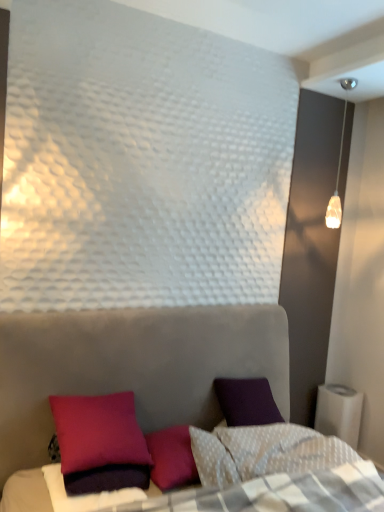
You are a GUI agent. You are given a task and a screenshot of the screen. Output one action in this format:
    pyautogui.click(x=<x>, y=<y>)
    Task: Click on the translucent glass pendant light at upper right
    The width and height of the screenshot is (384, 512).
    Given the screenshot: What is the action you would take?
    pyautogui.click(x=336, y=190)

From the picture: Is velvet purple pillow at lower left directly adjacent to purple matte pillow at lower left?

There is a gap between velvet purple pillow at lower left and purple matte pillow at lower left.

Considering the positions of objects velvet purple pillow at lower left and purple matte pillow at lower left in the image provided, who is more to the right, velvet purple pillow at lower left or purple matte pillow at lower left?

From the viewer's perspective, velvet purple pillow at lower left appears more on the right side.

This screenshot has height=512, width=384. I want to click on sheet in front of the velvet purple pillow at lower left, so click(x=85, y=495).

In the image, is velvet purple pillow at lower left positioned in front of or behind purple matte pillow at lower left?

velvet purple pillow at lower left is positioned farther from the viewer than purple matte pillow at lower left.

From a real-world perspective, between purple matte pillow at lower left and translucent glass pendant light at upper right, who is vertically lower?

purple matte pillow at lower left, from a real-world perspective.

Relative to translucent glass pendant light at upper right, is purple matte pillow at lower left in front or behind?

Visually, purple matte pillow at lower left is located in front of translucent glass pendant light at upper right.

Between purple matte pillow at lower left and translucent glass pendant light at upper right, which one has smaller size?

purple matte pillow at lower left.

Is purple matte pillow at lower left spatially inside translucent glass pendant light at upper right, or outside of it?

purple matte pillow at lower left is not inside translucent glass pendant light at upper right, it's outside.

From the image's perspective, which one is positioned lower, purple matte pillow at lower left or velvet purple pillow at lower left?

purple matte pillow at lower left.

How different are the orientations of purple matte pillow at lower left and velvet purple pillow at lower left in degrees?

There is a 1.27-degree angle between the facing directions of purple matte pillow at lower left and velvet purple pillow at lower left.

Looking at this image, is purple matte pillow at lower left turned away from velvet purple pillow at lower left?

No, purple matte pillow at lower left is not facing the opposite direction of velvet purple pillow at lower left.

Would you say purple matte pillow at lower left is outside velvet purple pillow at lower left?

That's correct, purple matte pillow at lower left is outside of velvet purple pillow at lower left.

From the image's perspective, is translucent glass pendant light at upper right located beneath velvet purple pillow at lower left?

No.

Measure the distance from translucent glass pendant light at upper right to velvet purple pillow at lower left.

translucent glass pendant light at upper right and velvet purple pillow at lower left are 6.41 feet apart from each other.

How different are the orientations of translucent glass pendant light at upper right and velvet purple pillow at lower left in degrees?

The angular difference between translucent glass pendant light at upper right and velvet purple pillow at lower left is 2.29 degrees.

This screenshot has width=384, height=512. I want to click on lamp behind the velvet purple pillow at lower left, so click(336, 190).

Which object is positioned more to the left, velvet purple pillow at lower left or translucent glass pendant light at upper right?

Positioned to the left is velvet purple pillow at lower left.

Considering the relative sizes of velvet purple pillow at lower left and translucent glass pendant light at upper right in the image provided, is velvet purple pillow at lower left smaller than translucent glass pendant light at upper right?

No, velvet purple pillow at lower left is not smaller than translucent glass pendant light at upper right.

Considering their positions, is velvet purple pillow at lower left located in front of or behind translucent glass pendant light at upper right?

Clearly, velvet purple pillow at lower left is in front of translucent glass pendant light at upper right.

Is purple matte pillow at lower left at the back of translucent glass pendant light at upper right?

translucent glass pendant light at upper right does not have its back to purple matte pillow at lower left.

Which of these two, translucent glass pendant light at upper right or purple matte pillow at lower left, is thinner?

With smaller width is translucent glass pendant light at upper right.

Is purple matte pillow at lower left surrounded by translucent glass pendant light at upper right?

No, purple matte pillow at lower left is not a part of translucent glass pendant light at upper right.

In terms of height, does translucent glass pendant light at upper right look taller or shorter compared to purple matte pillow at lower left?

Clearly, translucent glass pendant light at upper right is taller compared to purple matte pillow at lower left.

Where is `sheet below the velvet purple pillow at lower left (from a real-world perspective)`? Image resolution: width=384 pixels, height=512 pixels. sheet below the velvet purple pillow at lower left (from a real-world perspective) is located at coordinates (85, 495).

Where is `lamp above the purple matte pillow at lower left (from the image's perspective)`? This screenshot has height=512, width=384. lamp above the purple matte pillow at lower left (from the image's perspective) is located at coordinates (336, 190).

From the image, which object appears to be farther from translucent glass pendant light at upper right, velvet purple pillow at lower left or purple matte pillow at lower left?

purple matte pillow at lower left.

From the picture: From the image, which object appears to be farther from velvet purple pillow at lower left, translucent glass pendant light at upper right or purple matte pillow at lower left?

Based on the image, translucent glass pendant light at upper right appears to be further to velvet purple pillow at lower left.

Which object lies further to the anchor point velvet purple pillow at lower left, purple matte pillow at lower left or translucent glass pendant light at upper right?

The object further to velvet purple pillow at lower left is translucent glass pendant light at upper right.

Estimate the real-world distances between objects in this image. Which object is closer to purple matte pillow at lower left, translucent glass pendant light at upper right or velvet purple pillow at lower left?

velvet purple pillow at lower left is closer to purple matte pillow at lower left.

Estimate the real-world distances between objects in this image. Which object is further from translucent glass pendant light at upper right, purple matte pillow at lower left or velvet purple pillow at lower left?

purple matte pillow at lower left.

Considering their positions, is velvet purple pillow at lower left positioned closer to purple matte pillow at lower left than translucent glass pendant light at upper right?

velvet purple pillow at lower left lies closer to purple matte pillow at lower left than the other object.

Identify the location of pillow between translucent glass pendant light at upper right and purple matte pillow at lower left vertically. The image size is (384, 512). (98, 432).